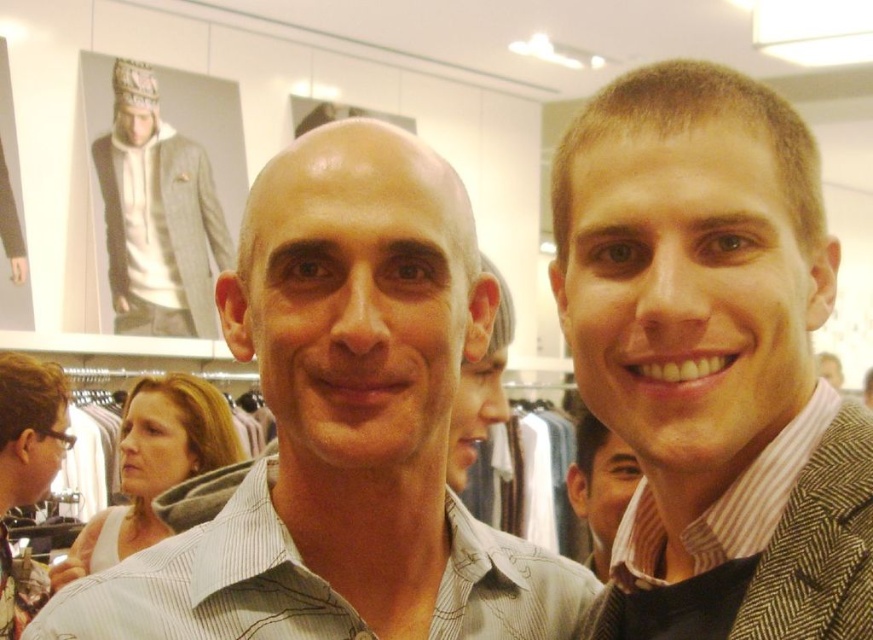
Does gray striped shirt at center have a greater height compared to white cotton hoodie at upper left?

No.

Is point (392, 586) farther from viewer compared to point (168, 253)?

No, (392, 586) is in front of (168, 253).

At what (x,y) coordinates should I click in order to perform the action: click on gray striped shirt at center. Please return your answer as a coordinate pair (x, y). Looking at the image, I should click on (344, 428).

Does gray striped shirt at center lie behind striped shirt at center?

Yes, it is behind striped shirt at center.

Which of these two, gray striped shirt at center or striped shirt at center, stands taller?

Standing taller between the two is striped shirt at center.

Between point (311, 244) and point (641, 461), which one is positioned behind?

Point (641, 461)

I want to click on gray striped shirt at center, so click(x=344, y=428).

Describe the element at coordinates (691, 280) in the screenshot. The image size is (873, 640). I see `striped shirt at center` at that location.

Is point (607, 214) positioned behind point (205, 330)?

No, it is not.

Identify the location of striped shirt at center. This screenshot has height=640, width=873. [691, 280].